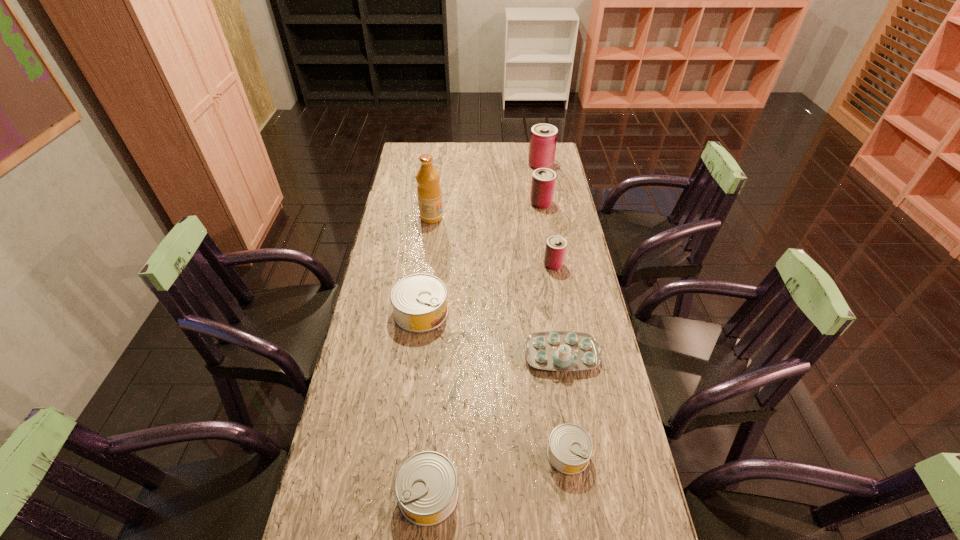
Choose which can is the third nearest neighbor to the fourth farthest can. Please provide its 2D coordinates. Your answer should be formatted as a tuple, i.e. [(x, y)], where the tuple contains the x and y coordinates of a point satisfying the conditions above.

[(570, 447)]

Identify which can is the fourth closest to the second biggest silver can. Please provide its 2D coordinates. Your answer should be formatted as a tuple, i.e. [(x, y)], where the tuple contains the x and y coordinates of a point satisfying the conditions above.

[(543, 182)]

Select which pink can appears as the closest to the smallest pink can. Please provide its 2D coordinates. Your answer should be formatted as a tuple, i.e. [(x, y)], where the tuple contains the x and y coordinates of a point satisfying the conditions above.

[(543, 182)]

Select which pink can is the second closest to the second shortest can. Please provide its 2D coordinates. Your answer should be formatted as a tuple, i.e. [(x, y)], where the tuple contains the x and y coordinates of a point satisfying the conditions above.

[(543, 182)]

Where is `silver can that is the closest to the second smallest silver can`? This screenshot has width=960, height=540. silver can that is the closest to the second smallest silver can is located at coordinates (570, 447).

Locate which silver can is the closest to the fourth nearest can. Please provide its 2D coordinates. Your answer should be formatted as a tuple, i.e. [(x, y)], where the tuple contains the x and y coordinates of a point satisfying the conditions above.

[(419, 301)]

Locate an element on the screen. vacant space that satisfies the following two spatial constraints: 1. on the back side of the fifth shortest can; 2. on the left side of the biggest silver can is located at coordinates (435, 203).

I want to click on free point that satisfies the following two spatial constraints: 1. on the front label of the third farthest object; 2. on the back side of the second biggest silver can, so click(396, 494).

In order to click on free location that satisfies the following two spatial constraints: 1. on the front label of the second biggest silver can; 2. on the right side of the third farthest object in this screenshot , I will do `click(396, 494)`.

At what (x,y) coordinates should I click in order to perform the action: click on vacant space that satisfies the following two spatial constraints: 1. on the front side of the fourth nearest can; 2. on the right side of the seventh nearest object. Please return your answer as a coordinate pair (x, y). Image resolution: width=960 pixels, height=540 pixels. Looking at the image, I should click on (551, 265).